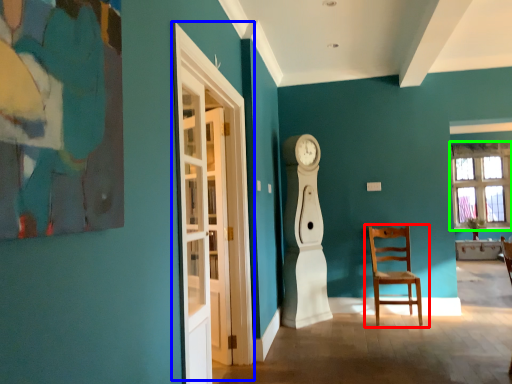
Question: Which object is the closest to the chair (highlighted by a red box)? Choose among these: glass door (highlighted by a blue box) or window (highlighted by a green box).

Choices:
 (A) glass door
 (B) window

Answer: (A)